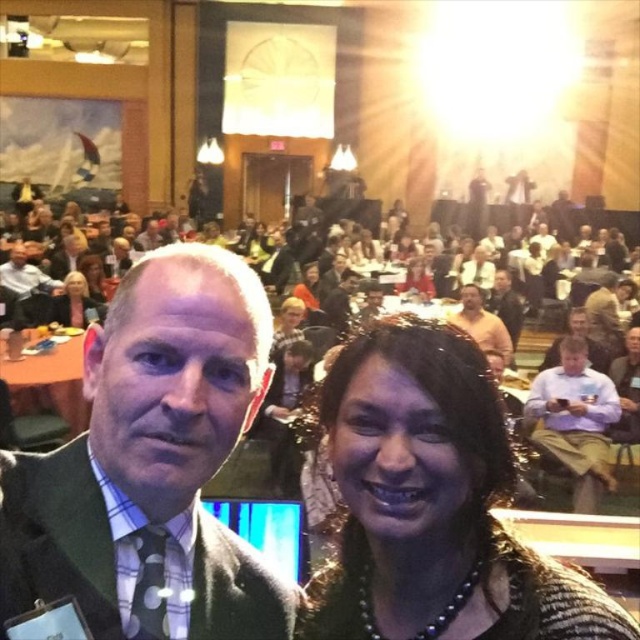
Question: Does matte black jacket at upper left appear on the left side of matte black suit at center?

Choices:
 (A) no
 (B) yes

Answer: (B)

Question: Which point appears closest to the camera in this image?

Choices:
 (A) (22, 244)
 (B) (624, 388)
 (C) (477, 326)

Answer: (B)

Question: Which is nearer to the light blue shirt at center?

Choices:
 (A) green wool suit at center
 (B) orange sweater at center
 (C) matte black suit at center
 (D) matte black jacket at upper left

Answer: (B)

Question: Which object is farther from the camera taking this photo?

Choices:
 (A) matte black jacket at upper left
 (B) orange sweater at center

Answer: (A)

Question: Does matte black jacket at upper left have a smaller size compared to matte black suit at center?

Choices:
 (A) no
 (B) yes

Answer: (B)

Question: Is light blue shirt at center behind matte black jacket at upper left?

Choices:
 (A) no
 (B) yes

Answer: (A)